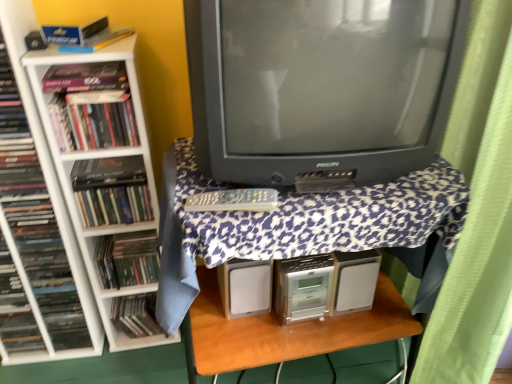
Image resolution: width=512 pixels, height=384 pixels. In order to click on empty space that is to the right of gray plastic remote at center in this screenshot , I will do (x=315, y=208).